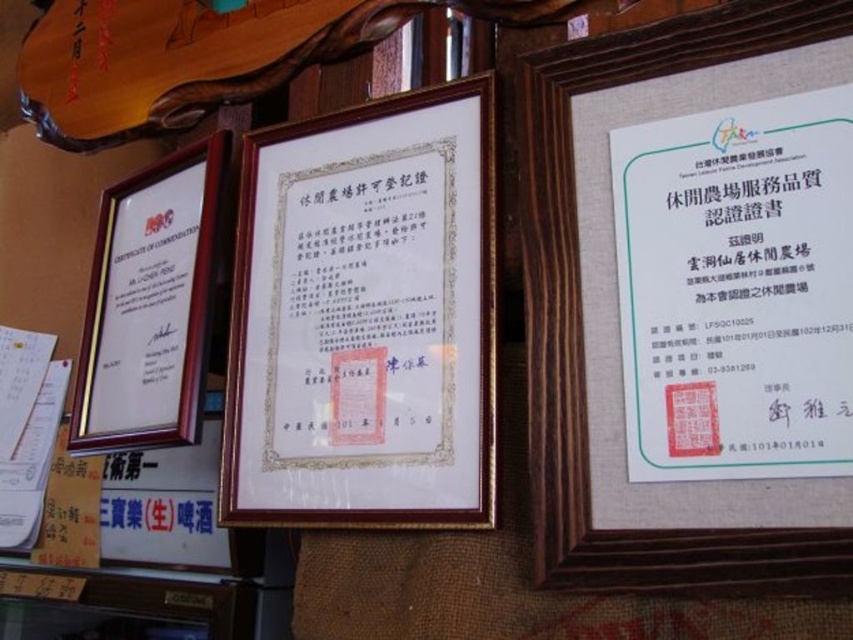
You are an interior designer assessing the wall arrangement. The wooden frame at center and wooden picture frame at left are part of a display. Which one is taller?

The wooden frame at center has a greater height compared to the wooden picture frame at left, so it is taller.

You are standing 6 feet away from the wall with the framed certificates. You want to touch the point at coordinates point (640, 273) with a 12 inch long stick. Can you reach it?

The point (640, 273) is 27.66 inches away from the camera. Since you are standing 6 feet away from the wall, which is 72 inches, and the stick is 12 inches long, the total distance you can reach is 84 inches. Since 84 inches is greater than 27.66 inches, you can reach the point with the stick.

Based on the scene description, where is the wooden frame at center located in terms of its 2D coordinates?

The wooden frame at center is located at the 2D coordinates point (364, 317).